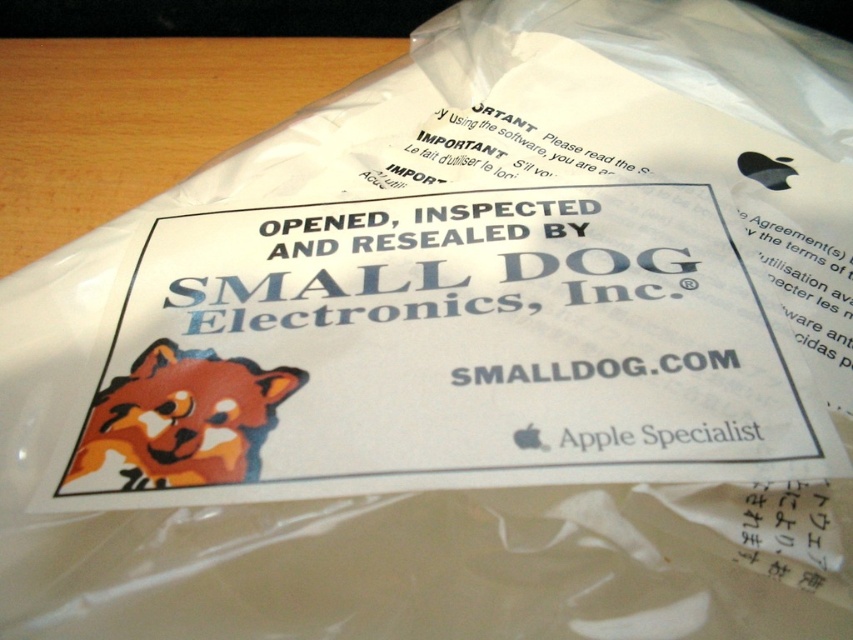
You are a customer who just received a package and see the wooden table at upper left and the orange fur dog at center. Which object is taller?

The wooden table at upper left is much taller than the orange fur dog at center.